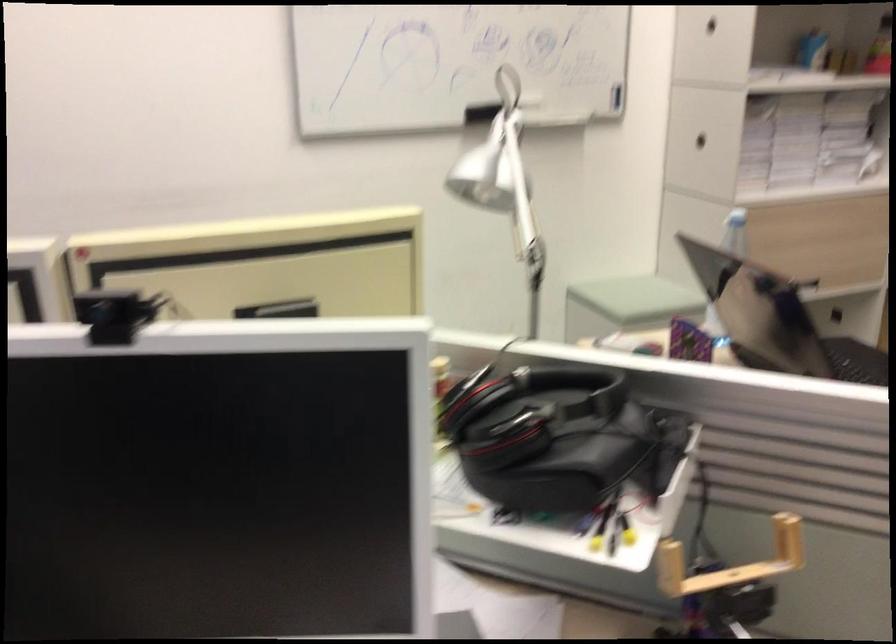
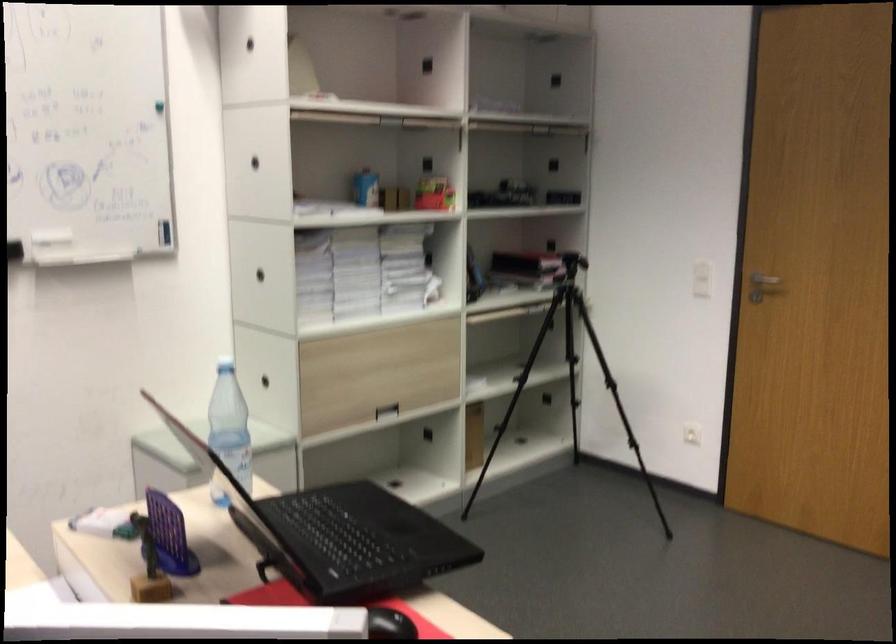
Question: The images are taken continuously from a first-person perspective. In which direction are you moving?

Choices:
 (A) Left
 (B) Right
 (C) Forward
 (D) Backward

Answer: (B)